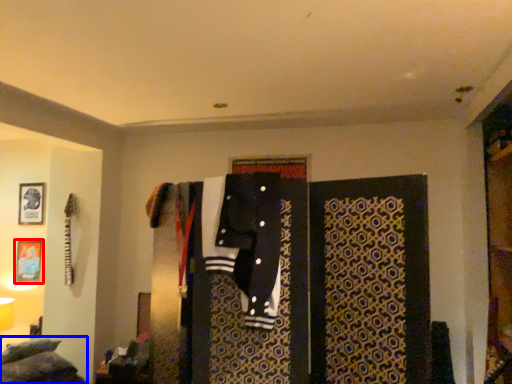
Question: Which object is further to the camera taking this photo, picture frame (highlighted by a red box) or bed (highlighted by a blue box)?

Choices:
 (A) picture frame
 (B) bed

Answer: (A)